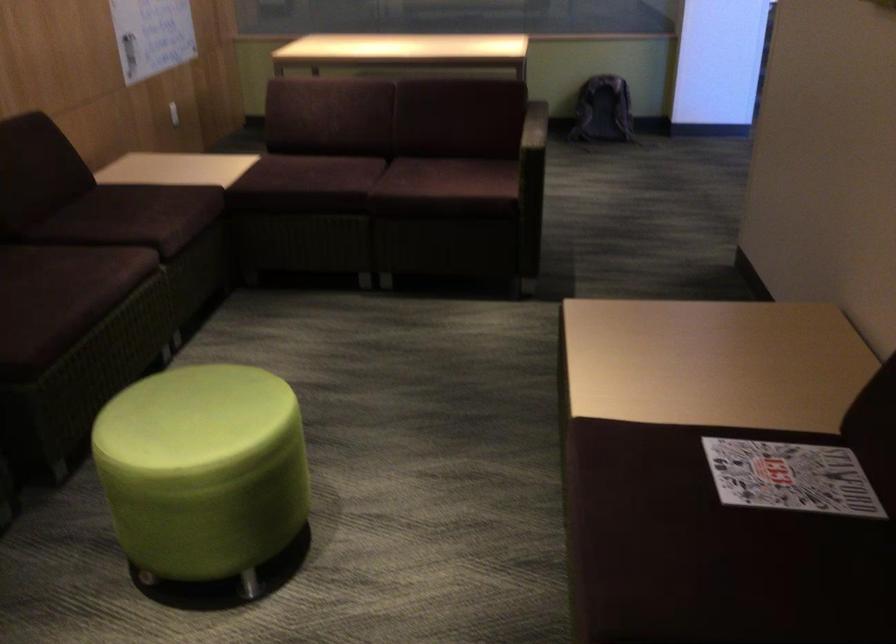
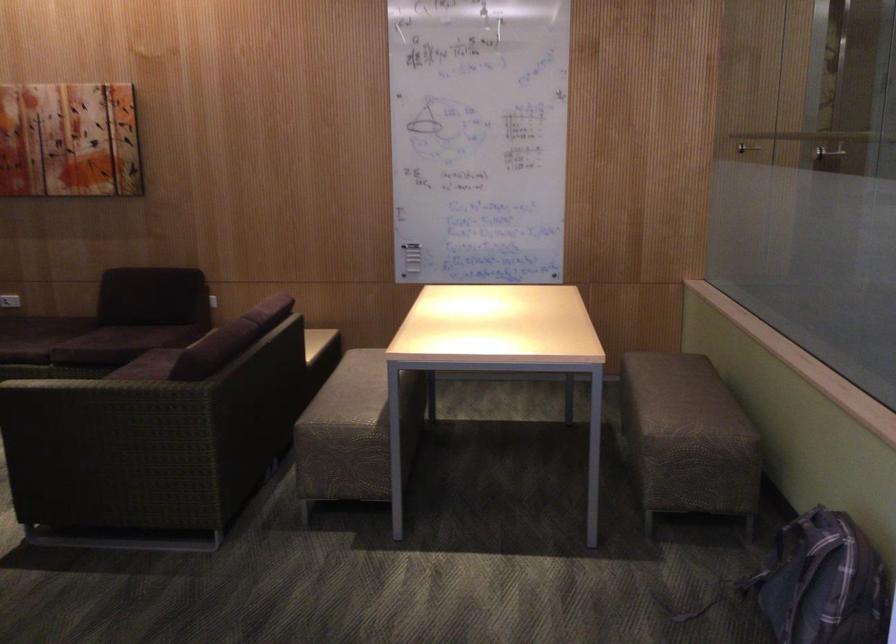
Where in the second image is the point corresponding to (540,135) from the first image?

(96, 382)